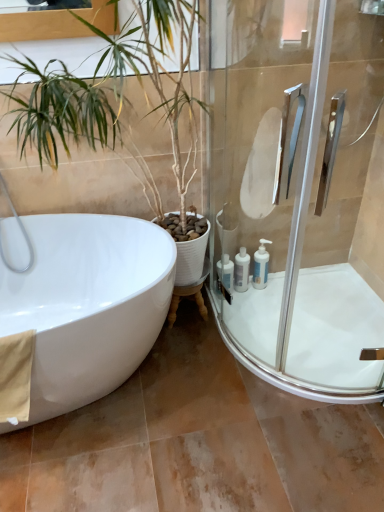
At what (x,y) coordinates should I click in order to perform the action: click on white glossy bathtub at left. Please return your answer as a coordinate pair (x, y). The image size is (384, 512). Looking at the image, I should click on (87, 305).

Describe the element at coordinates (299, 192) in the screenshot. This screenshot has height=512, width=384. I see `clear glass shower door at right` at that location.

Locate an element on the screen. white plastic bottles at right, marked as the first toiletry in a right-to-left arrangement is located at coordinates (261, 265).

What is the approximate height of beige fabric towel at lower left?

It is 35.81 centimeters.

Image resolution: width=384 pixels, height=512 pixels. Describe the element at coordinates (111, 90) in the screenshot. I see `green leafy plant at left` at that location.

Locate an element on the screen. white plastic bottles at lower right, positioned as the 1th toiletry in left-to-right order is located at coordinates (225, 272).

Is white glossy bath at lower right wider or thinner than white glossy bottle at lower right, marked as the 2th toiletry in a right-to-left arrangement?

white glossy bath at lower right is wider than white glossy bottle at lower right, marked as the 2th toiletry in a right-to-left arrangement.

From a real-world perspective, which is physically above, white glossy bath at lower right or white glossy bottle at lower right, marked as the 2th toiletry in a right-to-left arrangement?

In real-world perspective, white glossy bottle at lower right, marked as the 2th toiletry in a right-to-left arrangement, is above.

Does point (288, 371) come farther from viewer compared to point (236, 281)?

No.

Is white glossy bath at lower right to the right of white glossy bottle at lower right, the second toiletry when ordered from left to right, from the viewer's perspective?

Correct, you'll find white glossy bath at lower right to the right of white glossy bottle at lower right, the second toiletry when ordered from left to right.

Find the location of a particular element. shower door below the green leafy plant at left (from the image's perspective) is located at coordinates (299, 192).

Considering the relative sizes of green leafy plant at left and clear glass shower door at right in the image provided, is green leafy plant at left thinner than clear glass shower door at right?

In fact, green leafy plant at left might be wider than clear glass shower door at right.

Does green leafy plant at left have a smaller size compared to clear glass shower door at right?

No, green leafy plant at left is not smaller than clear glass shower door at right.

Would you say green leafy plant at left is outside clear glass shower door at right?

Yes, green leafy plant at left is outside of clear glass shower door at right.

Can you confirm if clear glass shower door at right is positioned to the right of white plastic bottles at lower right, the 3th toiletry viewed from the right?

Correct, you'll find clear glass shower door at right to the right of white plastic bottles at lower right, the 3th toiletry viewed from the right.

In terms of width, does clear glass shower door at right look wider or thinner when compared to white plastic bottles at lower right, positioned as the 1th toiletry in left-to-right order?

Considering their sizes, clear glass shower door at right looks broader than white plastic bottles at lower right, positioned as the 1th toiletry in left-to-right order.

Is clear glass shower door at right positioned with its back to white plastic bottles at lower right, the 3th toiletry viewed from the right?

That's right, clear glass shower door at right is facing away from white plastic bottles at lower right, the 3th toiletry viewed from the right.

From the image's perspective, is clear glass shower door at right located above or below white plastic bottles at lower right, positioned as the 1th toiletry in left-to-right order?

clear glass shower door at right is situated higher than white plastic bottles at lower right, positioned as the 1th toiletry in left-to-right order, in the image.

Which is closer, (256,277) or (240,288)?

Point (256,277) is farther from the camera than point (240,288).

Who is shorter, white plastic bottles at right, marked as the first toiletry in a right-to-left arrangement, or white glossy bottle at lower right, marked as the 2th toiletry in a right-to-left arrangement?

With less height is white glossy bottle at lower right, marked as the 2th toiletry in a right-to-left arrangement.

Looking at their sizes, would you say white plastic bottles at right, positioned as the third toiletry in left-to-right order, is wider or thinner than white glossy bottle at lower right, marked as the 2th toiletry in a right-to-left arrangement?

Considering their sizes, white plastic bottles at right, positioned as the third toiletry in left-to-right order, looks slimmer than white glossy bottle at lower right, marked as the 2th toiletry in a right-to-left arrangement.

How far apart are white glossy bathtub at left and white glossy bottle at lower right, the second toiletry when ordered from left to right?

They are 31.47 inches apart.

Between point (31, 220) and point (248, 268), which one is positioned behind?

Positioned behind is point (248, 268).

Considering the positions of objects white glossy bathtub at left and white glossy bottle at lower right, the second toiletry when ordered from left to right, in the image provided, who is more to the left, white glossy bathtub at left or white glossy bottle at lower right, the second toiletry when ordered from left to right,?

white glossy bathtub at left.

Could you tell me if white glossy bathtub at left is facing white glossy bottle at lower right, the second toiletry when ordered from left to right?

No, white glossy bathtub at left is not facing towards white glossy bottle at lower right, the second toiletry when ordered from left to right.

Is beige fabric towel at lower left taller or shorter than white glossy bathtub at left?

beige fabric towel at lower left is shorter than white glossy bathtub at left.

Looking at this image, from the image's perspective, between beige fabric towel at lower left and white glossy bathtub at left, which one is located above?

white glossy bathtub at left appears higher in the image.

Who is smaller, beige fabric towel at lower left or white glossy bathtub at left?

beige fabric towel at lower left is smaller.

Is white glossy bathtub at left bigger or smaller than white plastic bottles at right, positioned as the third toiletry in left-to-right order?

white glossy bathtub at left is bigger than white plastic bottles at right, positioned as the third toiletry in left-to-right order.

From a real-world perspective, does white glossy bathtub at left stand above white plastic bottles at right, marked as the first toiletry in a right-to-left arrangement?

Yes, from a real-world perspective, white glossy bathtub at left is on top of white plastic bottles at right, marked as the first toiletry in a right-to-left arrangement.

Which is in front, point (84, 348) or point (265, 264)?

The point (84, 348) is in front.

Is white glossy bathtub at left in contact with white plastic bottles at right, positioned as the third toiletry in left-to-right order?

No, white glossy bathtub at left is not touching white plastic bottles at right, positioned as the third toiletry in left-to-right order.

From a real-world perspective, count 1st toiletrys upward from the white glossy bath at lower right and point to it. Please provide its 2D coordinates.

[(241, 270)]

Where is `shower door below the green leafy plant at left (from a real-world perspective)`? The height and width of the screenshot is (512, 384). shower door below the green leafy plant at left (from a real-world perspective) is located at coordinates (299, 192).

Which object lies nearer to the anchor point beige fabric towel at lower left, white plastic bottles at right, marked as the first toiletry in a right-to-left arrangement, or white glossy bottle at lower right, the second toiletry when ordered from left to right?

white glossy bottle at lower right, the second toiletry when ordered from left to right, is closer to beige fabric towel at lower left.

Considering their positions, is white glossy bottle at lower right, the second toiletry when ordered from left to right, positioned further to white glossy bathtub at left than clear glass shower door at right?

white glossy bottle at lower right, the second toiletry when ordered from left to right.

When comparing their distances from white plastic bottles at lower right, the 3th toiletry viewed from the right, does white glossy bath at lower right or white plastic bottles at right, positioned as the third toiletry in left-to-right order, seem closer?

The object closer to white plastic bottles at lower right, the 3th toiletry viewed from the right, is white plastic bottles at right, positioned as the third toiletry in left-to-right order.

Looking at the image, which one is located closer to beige fabric towel at lower left, white glossy bath at lower right or white glossy bathtub at left?

Based on the image, white glossy bathtub at left appears to be nearer to beige fabric towel at lower left.

Considering their positions, is white plastic bottles at right, positioned as the third toiletry in left-to-right order, positioned closer to white glossy bathtub at left than clear glass shower door at right?

Among the two, clear glass shower door at right is located nearer to white glossy bathtub at left.

Based on their spatial positions, is white glossy bottle at lower right, marked as the 2th toiletry in a right-to-left arrangement, or white glossy bath at lower right closer to white glossy bathtub at left?

The object closer to white glossy bathtub at left is white glossy bottle at lower right, marked as the 2th toiletry in a right-to-left arrangement.

From the image, which object appears to be nearer to white glossy bottle at lower right, the second toiletry when ordered from left to right, clear glass shower door at right or white plastic bottles at lower right, positioned as the 1th toiletry in left-to-right order?

white plastic bottles at lower right, positioned as the 1th toiletry in left-to-right order, is positioned closer to the anchor white glossy bottle at lower right, the second toiletry when ordered from left to right.

From the picture: Estimate the real-world distances between objects in this image. Which object is further from clear glass shower door at right, green leafy plant at left or white plastic bottles at right, marked as the first toiletry in a right-to-left arrangement?

white plastic bottles at right, marked as the first toiletry in a right-to-left arrangement, lies further to clear glass shower door at right than the other object.

This screenshot has height=512, width=384. I want to click on houseplant between white glossy bathtub at left and clear glass shower door at right from left to right, so click(111, 90).

The height and width of the screenshot is (512, 384). Identify the location of shower door positioned between green leafy plant at left and white plastic bottles at right, positioned as the third toiletry in left-to-right order, from near to far. (299, 192).

Locate an element on the screen. This screenshot has width=384, height=512. bath between green leafy plant at left and white plastic bottles at lower right, positioned as the 1th toiletry in left-to-right order, in the front-back direction is located at coordinates (314, 329).

Image resolution: width=384 pixels, height=512 pixels. What are the coordinates of `bathtub between green leafy plant at left and white plastic bottles at lower right, the 3th toiletry viewed from the right, from front to back` in the screenshot? It's located at (87, 305).